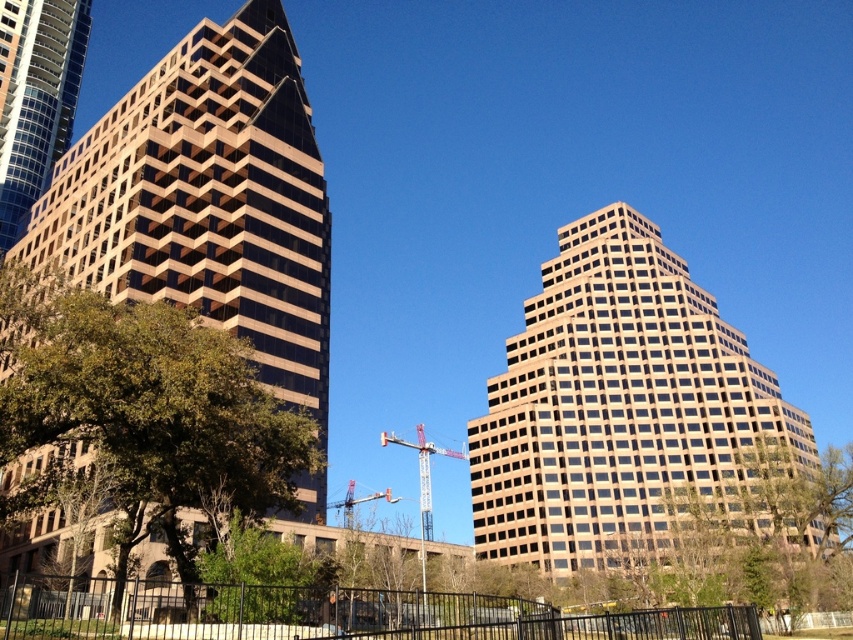
In the scene shown: You are a city planner evaluating the layout of the cityscape. You notice the beige glass building at center and the metallic silver crane at center. Based on their positions, which one is closer to the right edge of the image?

The beige glass building at center is to the right of the metallic silver crane at center, so the beige glass building at center is closer to the right edge of the image.